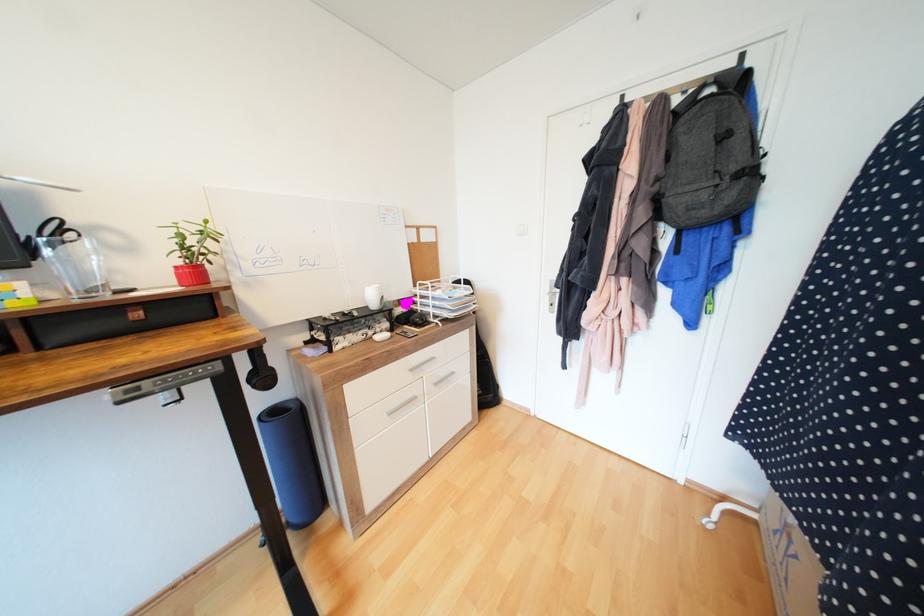
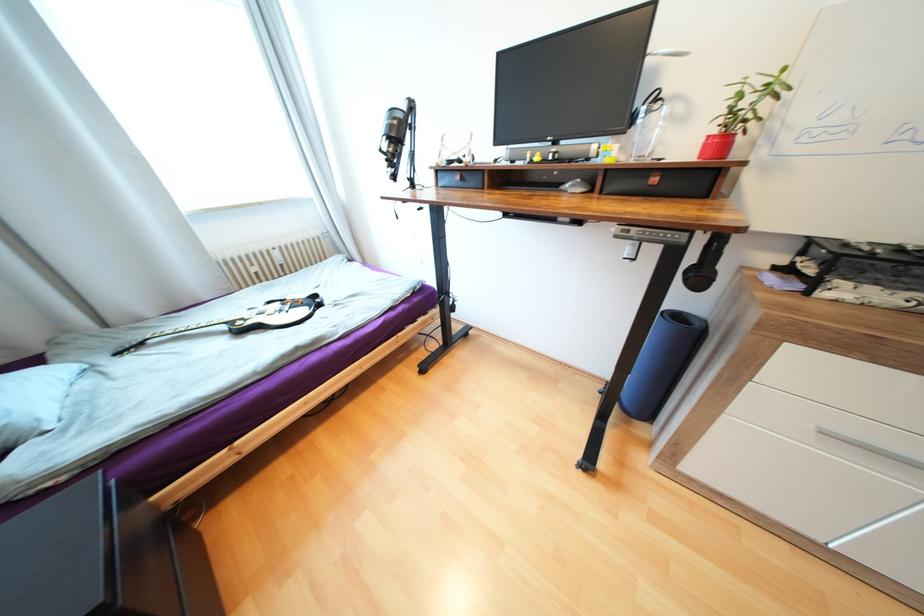
Locate, in the second image, the point that corresponds to (x=281, y=411) in the first image.

(685, 315)